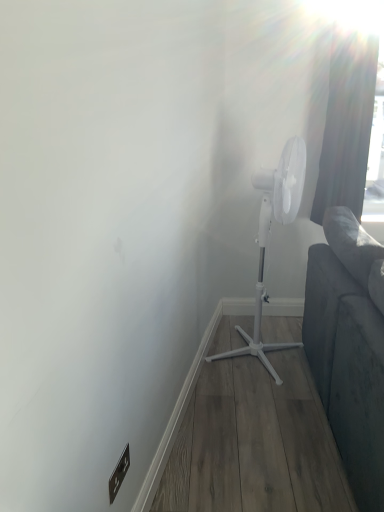
Locate an element on the screen. This screenshot has width=384, height=512. free space in front of white plastic mechanical fan at center is located at coordinates (257, 396).